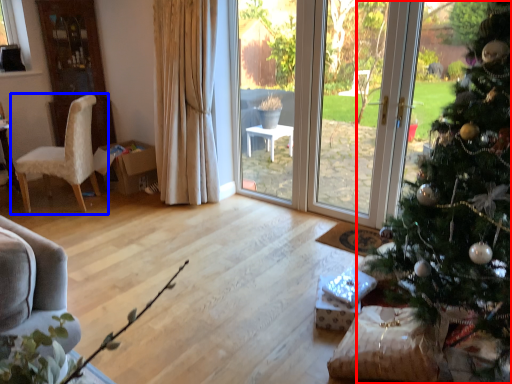
Question: Which point is further to the camera, christmas tree (highlighted by a red box) or chair (highlighted by a blue box)?

Choices:
 (A) christmas tree
 (B) chair

Answer: (B)